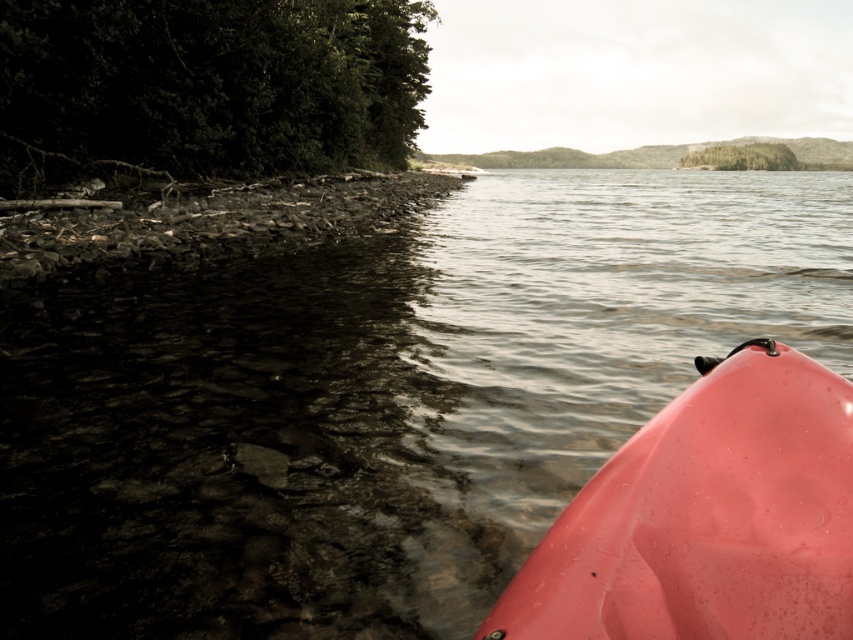
You are in a red kayak and want to reach a floating dock that is not visible in the image. The transparent water at lower right is your current position. If the dock is 3.14 meters away from your current position, will you be able to see it from your current vantage point?

The transparent water at lower right is your current position, and the dock is 3.14 meters away. Since the dock is within the visible range of the lake and not obstructed by the trees or hills, you should be able to see it from your current vantage point.